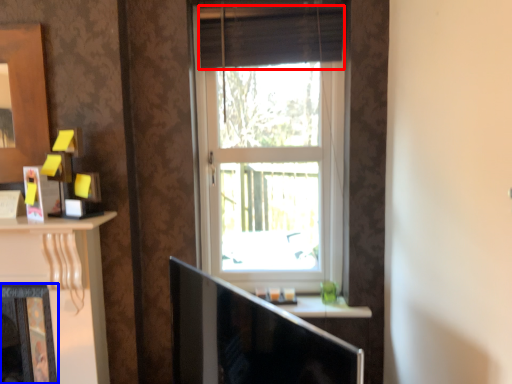
Question: Which of the following is the farthest to the observer, curtain (highlighted by a red box) or fireplace (highlighted by a blue box)?

Choices:
 (A) curtain
 (B) fireplace

Answer: (A)